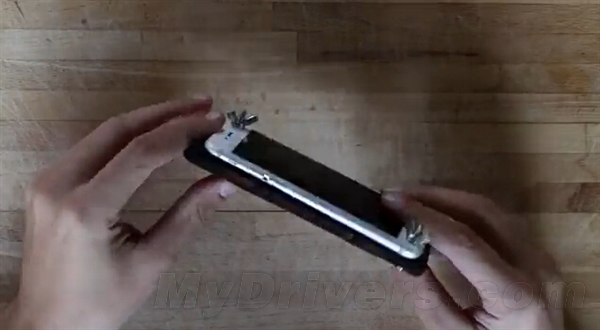
You are a GUI agent. You are given a task and a screenshot of the screen. Output one action in this format:
    pyautogui.click(x=<x>, y=<y>)
    Task: Click on the table
    
    Given the screenshot: What is the action you would take?
    pyautogui.click(x=372, y=121)